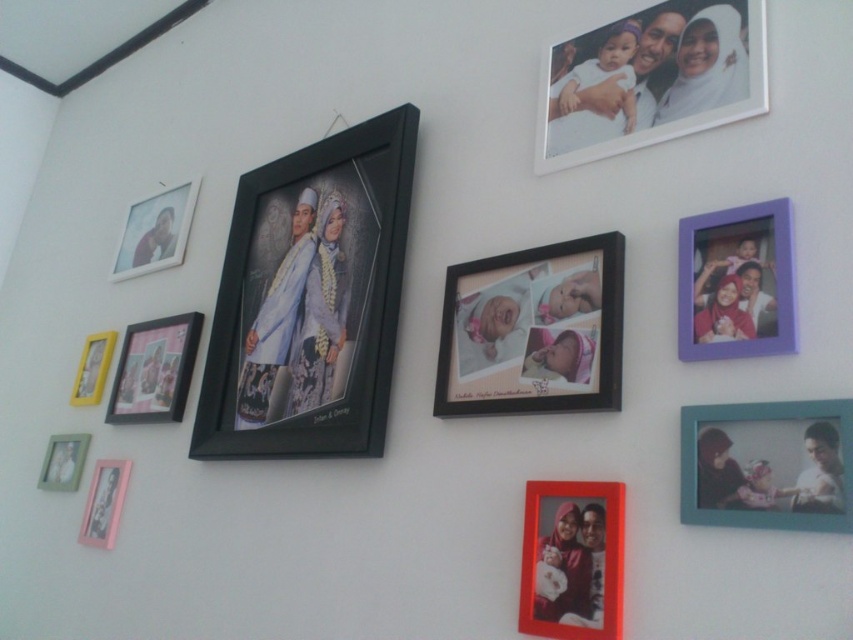
In the scene shown: You are hanging a new picture frame on the wall and want to place it between the pink glossy picture frame at lower left and the yellow matte picture frame at lower left. Which frame should you position the new frame closer to if you want it to be taller than both?

The yellow matte picture frame at lower left is taller than the pink glossy picture frame at lower left. To have the new frame taller than both, position it closer to the yellow matte picture frame at lower left since it is the taller one of the two.

You are standing in front of a wall with many framed photos. There is a point marked at coordinates (x=103, y=502). What is located at this point?

The point at coordinates (x=103, y=502) indicates the location of the pink glossy picture frame at lower left.

Based on the photo, you are a professional photographer organizing a gallery. You have two frames, the black matte picture frame at center and the pink matte picture frame at left. You need to place them on a wall that can only accommodate a minimum distance of 12 inches between items. Can you place them as per the current spacing?

The black matte picture frame at center is 13.29 inches from the pink matte picture frame at left. Since the required minimum distance is 12 inches, the current spacing of 13.29 inches meets the requirement, so yes, they can be placed as they are.